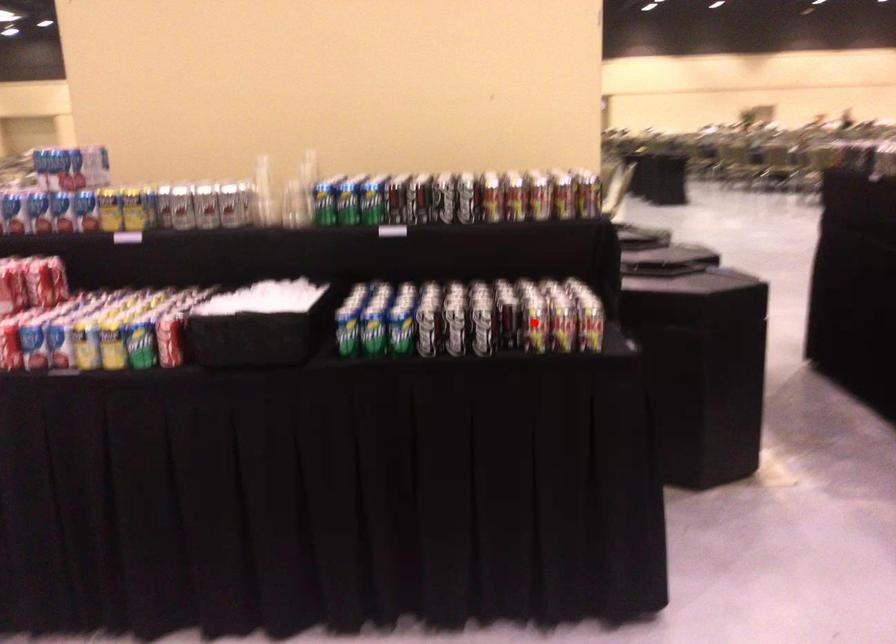
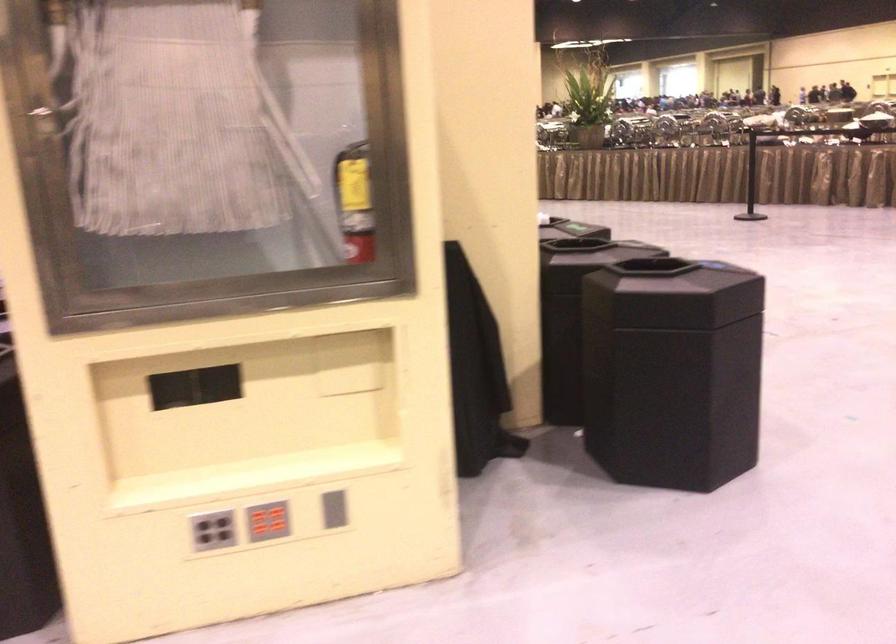
Question: I am providing you with two images of the same scene from different viewpoints. A red point is marked on the first image. At the location where the point appears in image 1, is it still visible in image 2?

Choices:
 (A) Yes
 (B) No

Answer: (B)